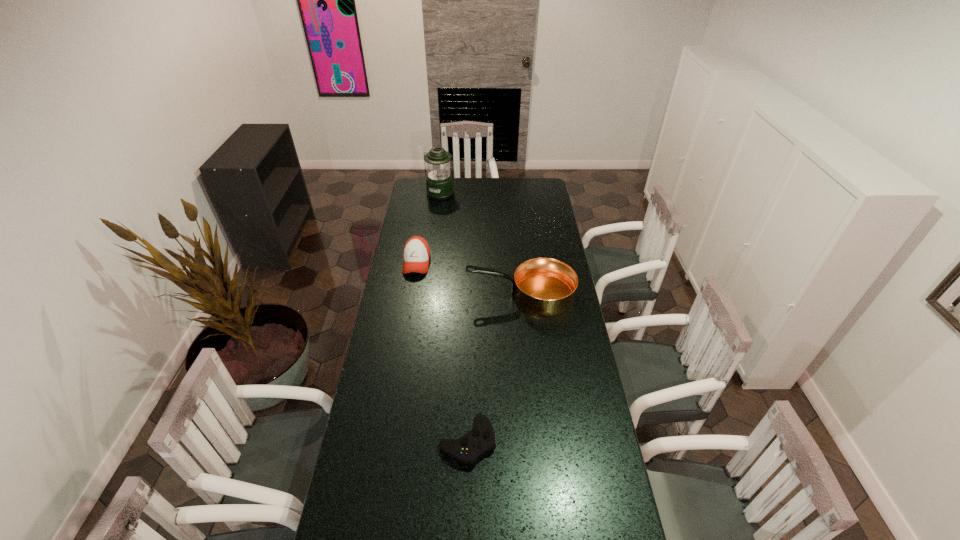
Locate an element on the screen. vacant space at the far left corner of the desktop is located at coordinates (415, 180).

In the image, there is a desktop. Identify the location of blank space at the far right corner. This screenshot has width=960, height=540. (541, 181).

Locate an element on the screen. The height and width of the screenshot is (540, 960). vacant space in between the frying pan and the second shortest object is located at coordinates (468, 279).

Locate an element on the screen. vacant point located between the baseball cap and the lantern is located at coordinates (429, 228).

In order to click on empty space between the control and the third shortest object in this screenshot , I will do `click(494, 368)`.

This screenshot has width=960, height=540. In order to click on vacant region between the shortest object and the tallest object in this screenshot , I will do `click(454, 318)`.

You are a GUI agent. You are given a task and a screenshot of the screen. Output one action in this format:
    pyautogui.click(x=<x>, y=<y>)
    Task: Click on the free space between the tallest object and the baseball cap
    
    Given the screenshot: What is the action you would take?
    pyautogui.click(x=429, y=228)

I want to click on free space between the third shortest object and the baseball cap, so (468, 279).

Identify the location of free space between the lantern and the control. The height and width of the screenshot is (540, 960). (454, 318).

Where is `empty space that is in between the frying pan and the lantern`? The width and height of the screenshot is (960, 540). empty space that is in between the frying pan and the lantern is located at coordinates (481, 244).